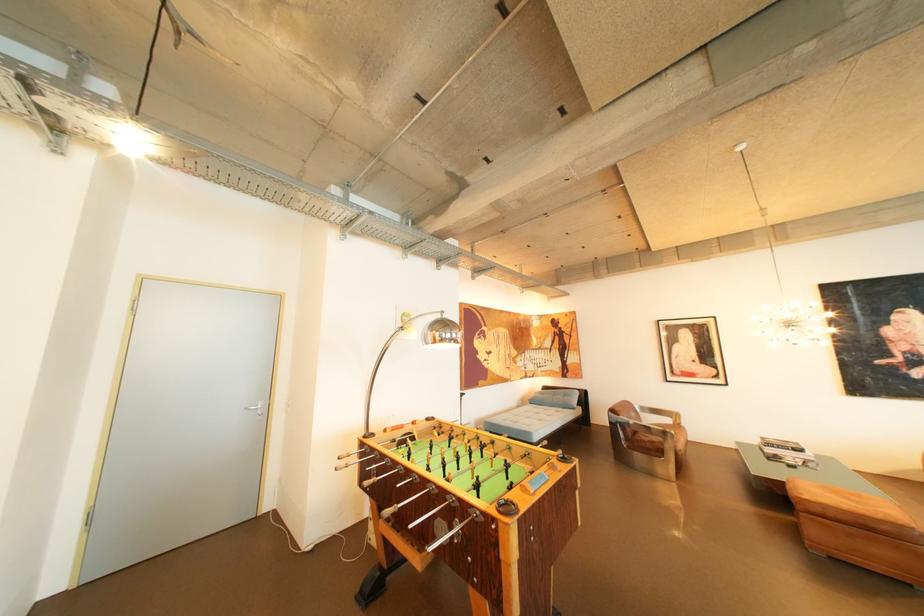
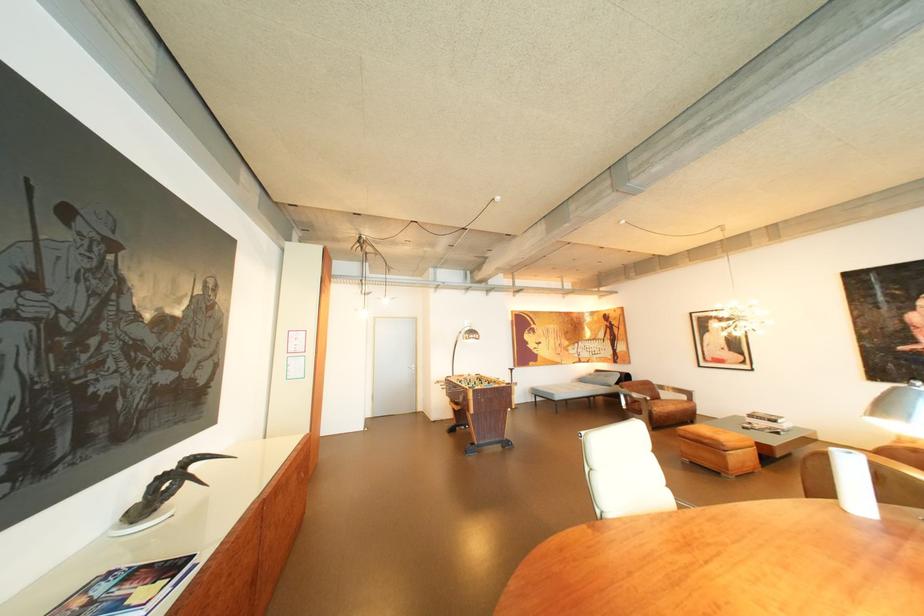
In the second image, find the point that corresponds to point (783, 446) in the first image.

(763, 416)